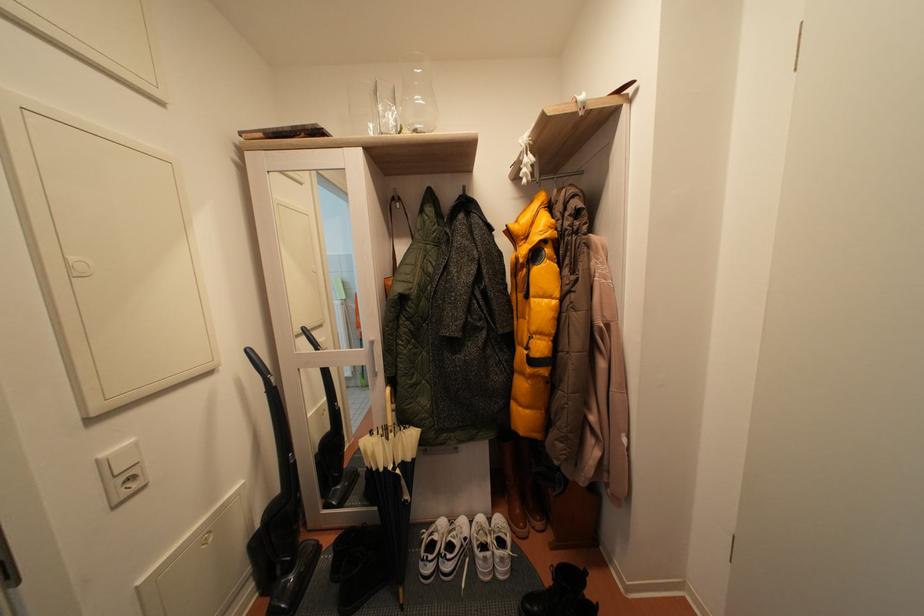
The width and height of the screenshot is (924, 616). Describe the element at coordinates (269, 387) in the screenshot. I see `the vacuum cleaner handle` at that location.